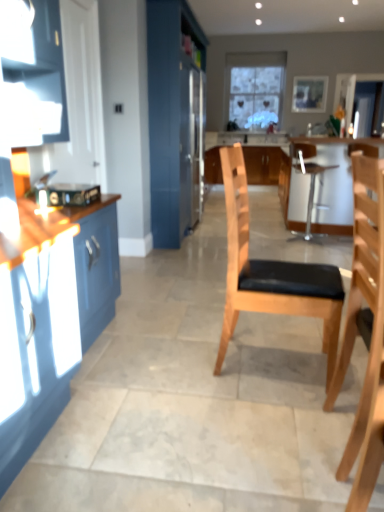
Question: Is light wood/black cushioned chair at center, placed as the first chair when sorted from left to right, to the left or to the right of metallic silver stool at center, acting as the first chair starting from the right, in the image?

Choices:
 (A) left
 (B) right

Answer: (A)

Question: From a real-world perspective, relative to metallic silver stool at center, acting as the first chair starting from the right, is light wood/black cushioned chair at center, the second chair in the back-to-front sequence, vertically above or below?

Choices:
 (A) above
 (B) below

Answer: (A)

Question: Estimate the real-world distances between objects in this image. Which object is closer to the metallic silver toaster at left?

Choices:
 (A) light brown wooden chair at center
 (B) wooden cabinet at center, the second cabinetry in the left-to-right sequence
 (C) light wood/black cushioned chair at center, the second chair in the back-to-front sequence
 (D) clear glass window at center
 (E) white glossy counter at center

Answer: (C)

Question: Which is nearer to the wooden cabinet at center, the 1th cabinetry when ordered from right to left?

Choices:
 (A) satin silver refrigerator at center, the first cabinetry in the front-to-back sequence
 (B) light wood/black cushioned chair at center, placed as the first chair when sorted from left to right
 (C) wooden picture frame at upper center
 (D) clear glass window at center
 (E) metallic silver stool at center, positioned as the third chair in front-to-back order

Answer: (D)